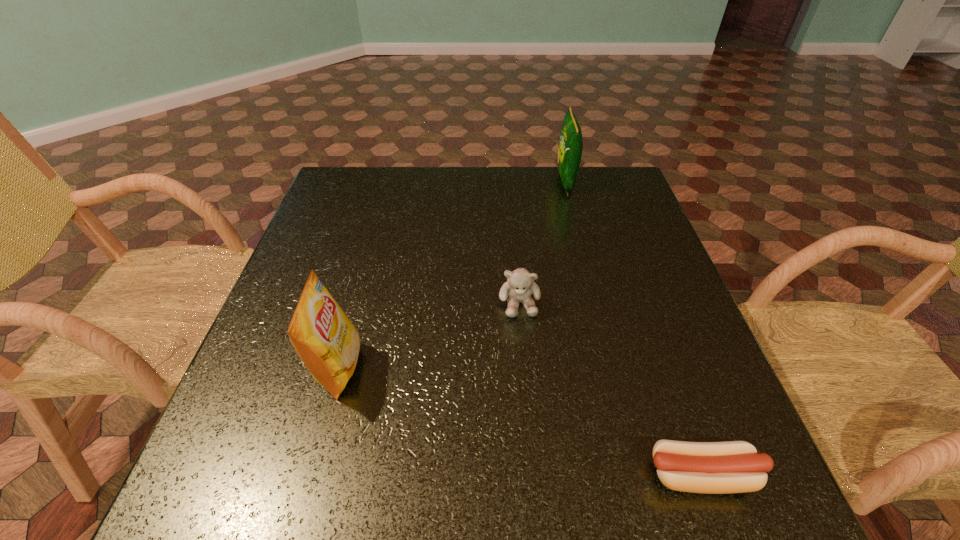
Locate an element on the screen. Image resolution: width=960 pixels, height=540 pixels. free region that satisfies the following two spatial constraints: 1. on the face of the teddy bear; 2. on the front-facing side of the nearer crisp (potato chip) is located at coordinates (525, 368).

You are a GUI agent. You are given a task and a screenshot of the screen. Output one action in this format:
    pyautogui.click(x=<x>, y=<y>)
    Task: Click on the vacant space that satisfies the following two spatial constraints: 1. on the front-facing side of the nearest object; 2. on the right side of the leftmost object
    This screenshot has width=960, height=540.
    Given the screenshot: What is the action you would take?
    pyautogui.click(x=309, y=475)

Identify the location of free point that satisfies the following two spatial constraints: 1. on the front-facing side of the nearer crisp (potato chip); 2. on the back side of the sausage. (309, 475).

Where is `vacant region that satisfies the following two spatial constraints: 1. on the face of the third nearest object; 2. on the front-facing side of the third farthest object`? Image resolution: width=960 pixels, height=540 pixels. vacant region that satisfies the following two spatial constraints: 1. on the face of the third nearest object; 2. on the front-facing side of the third farthest object is located at coordinates (525, 368).

In order to click on vacant region that satisfies the following two spatial constraints: 1. on the front-facing side of the right crisp (potato chip); 2. on the left side of the shortest object in this screenshot , I will do `click(640, 475)`.

Find the location of a particular element. The height and width of the screenshot is (540, 960). vacant region that satisfies the following two spatial constraints: 1. on the face of the nearest object; 2. on the right side of the third nearest object is located at coordinates (535, 475).

Locate an element on the screen. vacant region that satisfies the following two spatial constraints: 1. on the back side of the sausage; 2. on the front-facing side of the third farthest object is located at coordinates click(x=664, y=368).

Identify the location of free space that satisfies the following two spatial constraints: 1. on the front-facing side of the farthest object; 2. on the face of the teddy bear. (596, 303).

This screenshot has width=960, height=540. In order to click on free region that satisfies the following two spatial constraints: 1. on the back side of the sausage; 2. on the front-facing side of the right crisp (potato chip) in this screenshot , I will do `click(598, 182)`.

The width and height of the screenshot is (960, 540). In order to click on vacant space that satisfies the following two spatial constraints: 1. on the front-facing side of the farthest object; 2. on the face of the third object from right to left in this screenshot , I will do `click(596, 303)`.